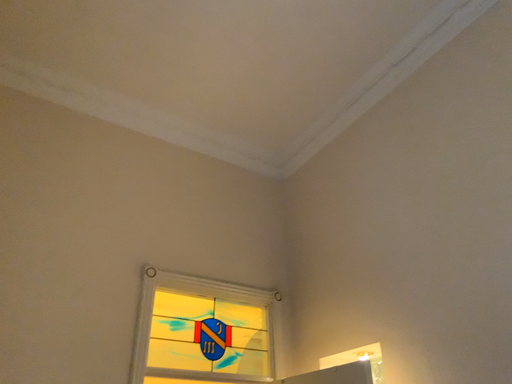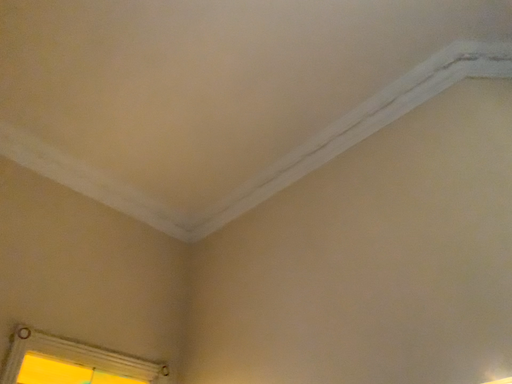
Question: How did the camera likely rotate when shooting the video?

Choices:
 (A) rotated upward
 (B) rotated downward

Answer: (A)